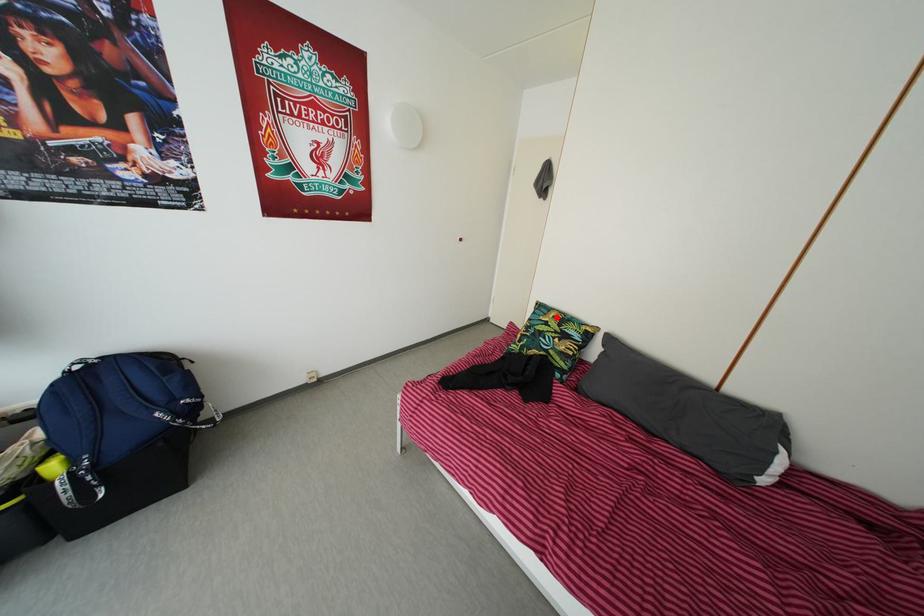
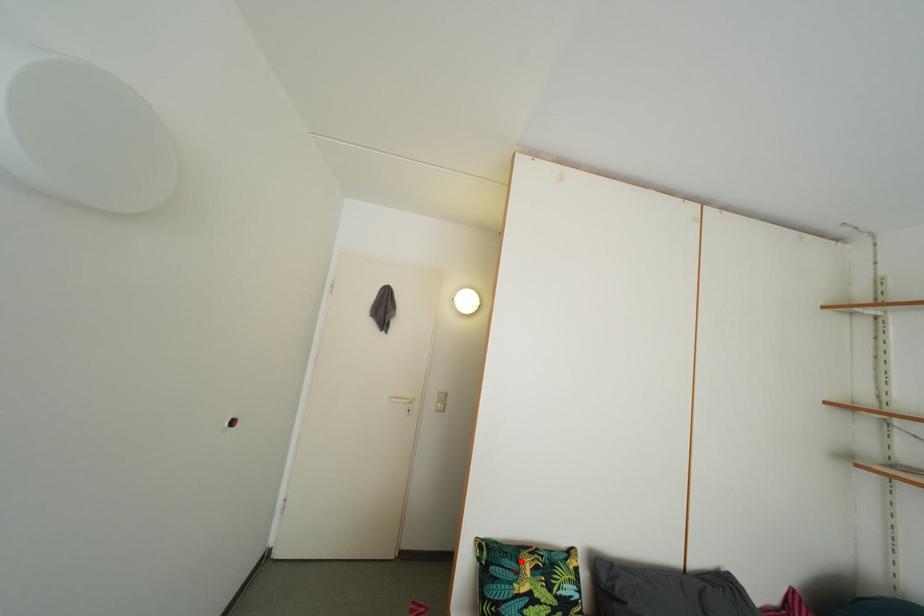
Looking at this image, I am providing you with two images of the same scene from different viewpoints. A red point is marked on the first image and another point is marked on the second image. Is the red point in image1 aligned with the point shown in image2?

Yes